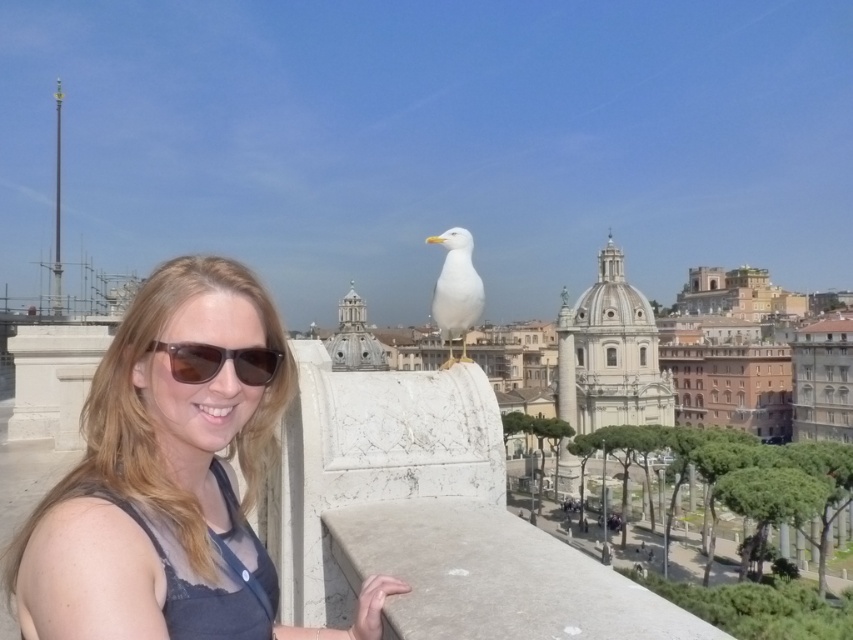
Is matte gray tank top at center to the right of brown matte sunglasses at center from the viewer's perspective?

In fact, matte gray tank top at center is to the left of brown matte sunglasses at center.

Is matte gray tank top at center taller than brown matte sunglasses at center?

Indeed, matte gray tank top at center has a greater height compared to brown matte sunglasses at center.

This screenshot has width=853, height=640. What do you see at coordinates (169, 483) in the screenshot?
I see `matte gray tank top at center` at bounding box center [169, 483].

The height and width of the screenshot is (640, 853). Identify the location of matte gray tank top at center. (169, 483).

Does matte gray tank top at center appear over white matte bird at center?

Actually, matte gray tank top at center is below white matte bird at center.

Can you confirm if matte gray tank top at center is taller than white matte bird at center?

Incorrect, matte gray tank top at center's height is not larger of white matte bird at center's.

Find the location of a particular element. The width and height of the screenshot is (853, 640). matte gray tank top at center is located at coordinates (169, 483).

Locate an element on the screen. Image resolution: width=853 pixels, height=640 pixels. matte gray tank top at center is located at coordinates (169, 483).

You are a GUI agent. You are given a task and a screenshot of the screen. Output one action in this format:
    pyautogui.click(x=<x>, y=<y>)
    Task: Click on the white matte bird at center
    The image size is (853, 640).
    Given the screenshot: What is the action you would take?
    456,291

Is point (480, 298) positioned in front of point (242, 349)?

No, it is not.

You are a GUI agent. You are given a task and a screenshot of the screen. Output one action in this format:
    pyautogui.click(x=<x>, y=<y>)
    Task: Click on the white matte bird at center
    
    Given the screenshot: What is the action you would take?
    [456, 291]